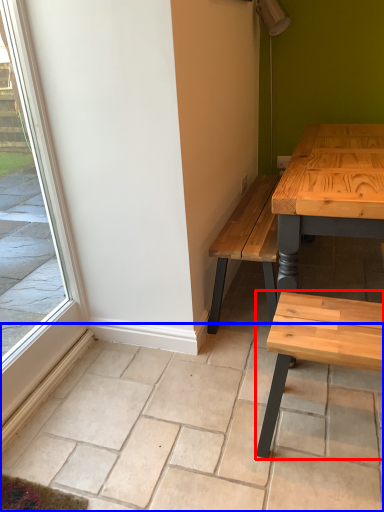
Question: Which object is further to the camera taking this photo, coffee table (highlighted by a red box) or tile (highlighted by a blue box)?

Choices:
 (A) coffee table
 (B) tile

Answer: (A)